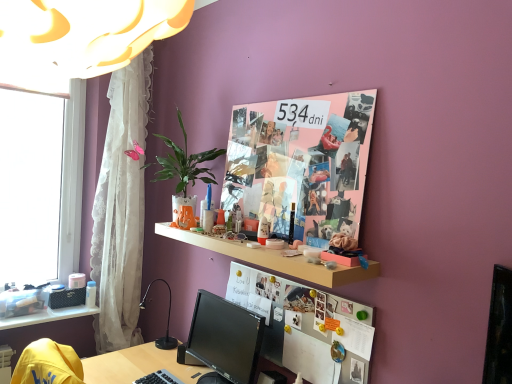
Question: From the image's perspective, is black glossy monitor at center above or below white plastic window at left?

Choices:
 (A) below
 (B) above

Answer: (A)

Question: Is black glossy monitor at center taller or shorter than white plastic window at left?

Choices:
 (A) short
 (B) tall

Answer: (A)

Question: Which object is the farthest from the wooden shelf at center, marked as the 1th shelf in a right-to-left arrangement?

Choices:
 (A) white lace curtain at left
 (B) black plastic keyboard at lower center
 (C) smooth skin face at upper center
 (D) white plastic window at left
 (E) whiteboard at center

Answer: (D)

Question: Which object is positioned farthest from the pink paper collage at upper center?

Choices:
 (A) white lace curtain at left
 (B) pink plastic houseplant at upper center
 (C) black glossy monitor at center
 (D) wooden shelf at center, the 2th shelf positioned from the bottom
 (E) clear plastic storage at lower left, which appears as the 2th shelf when viewed from the front

Answer: (E)